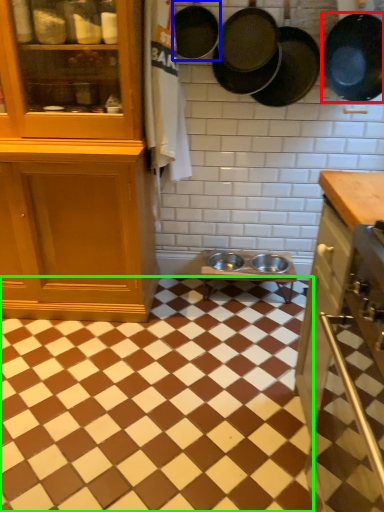
Question: Based on their relative distances, which object is nearer to frying pan (highlighted by a red box)? Choose from frying pan (highlighted by a blue box) and square (highlighted by a green box).

Choices:
 (A) frying pan
 (B) square

Answer: (A)